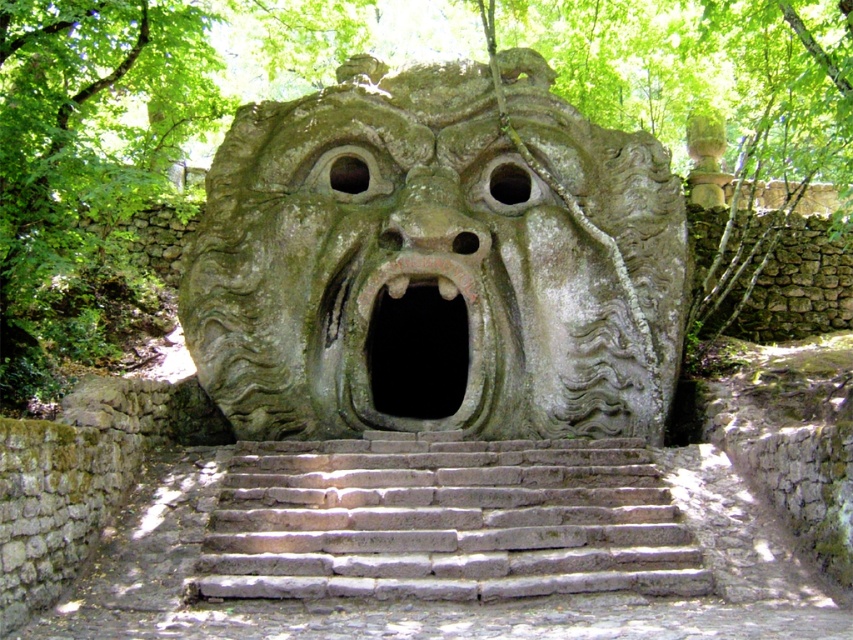
You are a hiker carrying a heavy backpack and want to climb the gray stone stairs at center. However, you notice the rusty metal mouth at center nearby. Which object is bigger in size between them?

The gray stone stairs at center has a larger size compared to the rusty metal mouth at center, so the gray stone stairs at center is bigger.